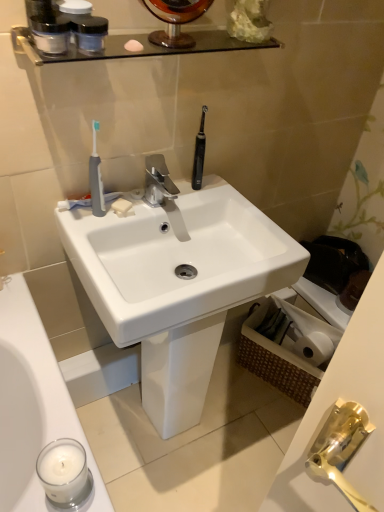
Identify the location of vacant space positioned to the left of polished chrome faucet at center. (119, 209).